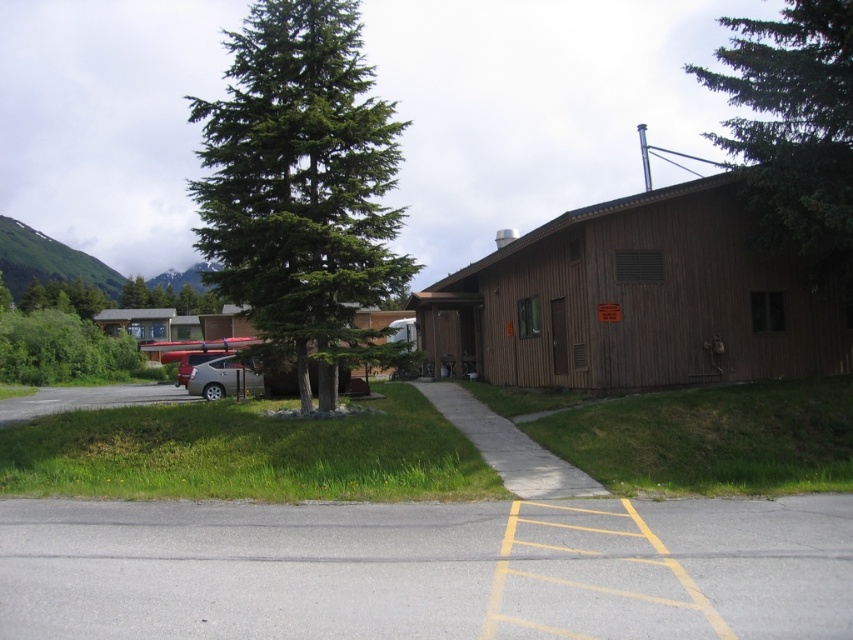
Question: From the image, what is the correct spatial relationship of green evergreen tree at upper center in relation to satin silver sedan at left?

Choices:
 (A) left
 (B) right

Answer: (B)

Question: Which point appears farthest from the camera in this image?

Choices:
 (A) (213, 356)
 (B) (351, 262)
 (C) (242, 384)

Answer: (A)

Question: Can you confirm if gray asphalt parking lot at lower center is positioned to the right of satin silver sedan at center-left?

Choices:
 (A) yes
 (B) no

Answer: (A)

Question: Which object is the farthest from the green evergreen tree at upper center?

Choices:
 (A) satin silver sedan at center-left
 (B) green matte tree at center

Answer: (B)

Question: Which point appears farthest from the camera in this image?

Choices:
 (A) (223, 394)
 (B) (224, 140)

Answer: (A)

Question: Is green evergreen tree at upper center behind satin silver sedan at left?

Choices:
 (A) no
 (B) yes

Answer: (A)